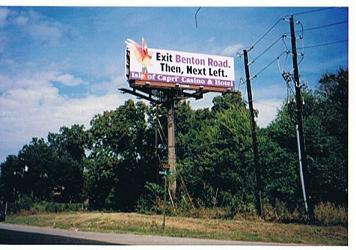
Identify the location of black wire. The height and width of the screenshot is (250, 356). (196, 23).